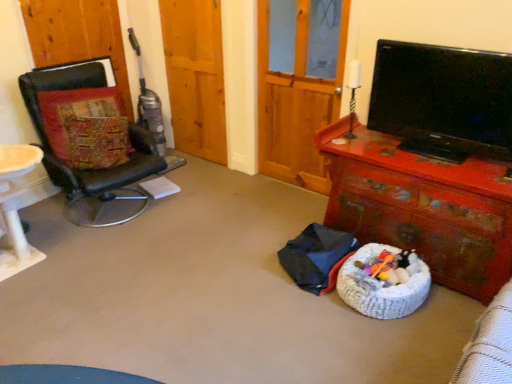
At what (x,y) coordinates should I click in order to perform the action: click on free space to the left of dark blue fabric at center. Please return your answer as a coordinate pair (x, y). Looking at the image, I should click on (241, 263).